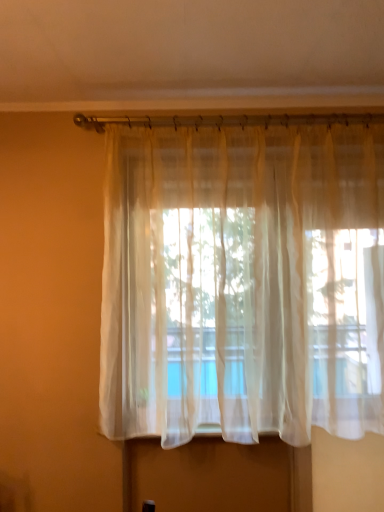
Identify the location of sheer white curtain at center. The width and height of the screenshot is (384, 512). (243, 282).

Image resolution: width=384 pixels, height=512 pixels. Describe the element at coordinates (243, 282) in the screenshot. I see `sheer white curtain at center` at that location.

At what (x,y) coordinates should I click in order to perform the action: click on sheer white curtain at center. Please return your answer as a coordinate pair (x, y). Looking at the image, I should click on (243, 282).